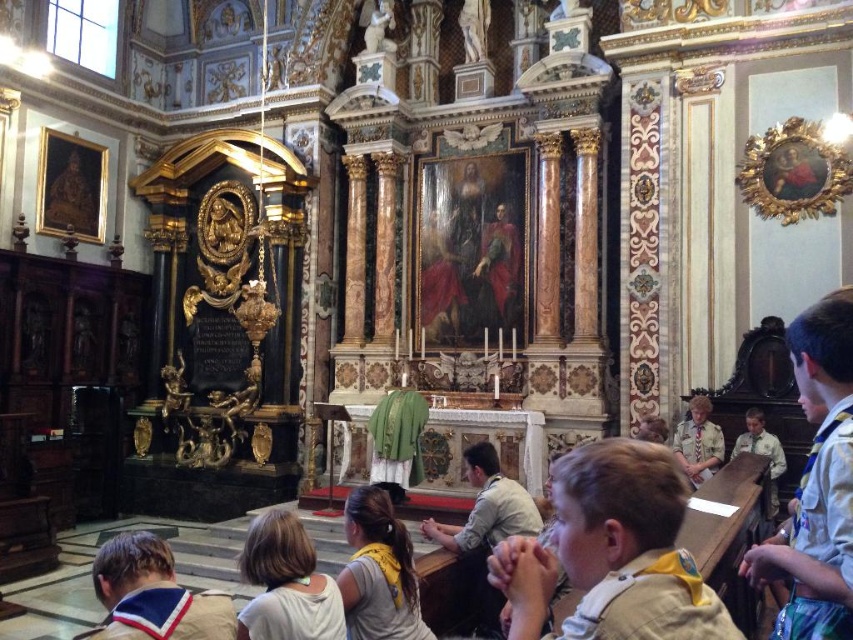
Question: Can you confirm if light brown uniform at center is smaller than gray fabric shirt at center?

Choices:
 (A) yes
 (B) no

Answer: (A)

Question: Considering the real-world distances, which object is closest to the gray fabric shirt at center?

Choices:
 (A) khaki uniform shirt at lower left
 (B) white fabric shirt at lower center

Answer: (B)

Question: Which object appears closest to the camera in this image?

Choices:
 (A) light brown uniform at center
 (B) khaki uniform shirt at lower left
 (C) khaki uniform at lower right
 (D) white fabric shirt at lower center

Answer: (A)

Question: Is gray fabric shirt at center positioned behind khaki uniform at lower right?

Choices:
 (A) yes
 (B) no

Answer: (B)

Question: Is light brown uniform at center in front of white fabric shirt at lower center?

Choices:
 (A) yes
 (B) no

Answer: (A)

Question: Based on their relative distances, which object is farther from the khaki uniform at lower right?

Choices:
 (A) khaki uniform shirt at lower left
 (B) white fabric shirt at lower center

Answer: (A)